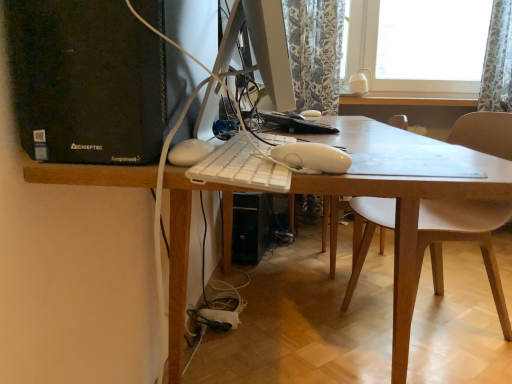
At what (x,y) coordinates should I click in order to perform the action: click on black plastic computer tower at left. Please return your answer as a coordinate pair (x, y). Image resolution: width=512 pixels, height=384 pixels. Looking at the image, I should click on (91, 81).

What do you see at coordinates (91, 81) in the screenshot? Image resolution: width=512 pixels, height=384 pixels. I see `black plastic computer tower at left` at bounding box center [91, 81].

The image size is (512, 384). What do you see at coordinates (403, 204) in the screenshot?
I see `white plastic desk at center` at bounding box center [403, 204].

What is the approximate width of white plastic keyboard at center?

The width of white plastic keyboard at center is 5.12 inches.

This screenshot has height=384, width=512. What are the coordinates of `floral fabric curtain at upper right` in the screenshot? It's located at (498, 61).

Describe the element at coordinates (498, 61) in the screenshot. This screenshot has width=512, height=384. I see `floral fabric curtain at upper right` at that location.

In order to click on black plastic computer tower at left in this screenshot , I will do `click(91, 81)`.

Identify the location of desk to the right of black plastic computer tower at left. (403, 204).

From a real-world perspective, is white plastic desk at center physically above black plastic computer tower at left?

No, from a real-world perspective, white plastic desk at center is not on top of black plastic computer tower at left.

Consider the image. In the image, is white plastic desk at center on the left side or the right side of black plastic computer tower at left?

Clearly, white plastic desk at center is on the right of black plastic computer tower at left in the image.

Which is closer to the camera, (x=128, y=171) or (x=20, y=123)?

Point (x=128, y=171) appears to be closer to the viewer than point (x=20, y=123).

How far apart are black plastic computer tower at left and white plastic keyboard at center?

black plastic computer tower at left is 9.49 inches away from white plastic keyboard at center.

Where is `computer keyboard in front of the black plastic computer tower at left`? computer keyboard in front of the black plastic computer tower at left is located at coordinates (240, 168).

Which of these two, black plastic computer tower at left or white plastic keyboard at center, is thinner?

Thinner between the two is white plastic keyboard at center.

In the scene shown: From a real-world perspective, is black plastic computer tower at left located beneath white plastic keyboard at center?

Actually, black plastic computer tower at left is physically above white plastic keyboard at center in the real world.

Is white plastic keyboard at center located within floral fabric curtain at upper right?

That's incorrect, white plastic keyboard at center is not inside floral fabric curtain at upper right.

Could you tell me if floral fabric curtain at upper right is facing white plastic keyboard at center?

No, floral fabric curtain at upper right does not turn towards white plastic keyboard at center.

Does point (490, 60) appear closer or farther from the camera than point (263, 159)?

Point (490, 60) is positioned farther from the camera compared to point (263, 159).

From a real-world perspective, does floral fabric curtain at upper right stand above black plastic computer tower at left?

Correct, in the physical world, floral fabric curtain at upper right is higher than black plastic computer tower at left.

Which is behind, point (510, 51) or point (103, 119)?

The point (510, 51) is more distant.

Does floral fabric curtain at upper right come behind black plastic computer tower at left?

Yes, it is.

Is floral fabric curtain at upper right far away from black plastic computer tower at left?

That's right, there is a large distance between floral fabric curtain at upper right and black plastic computer tower at left.

Are black plastic computer tower at left and floral fabric curtain at upper right located far from each other?

Yes, black plastic computer tower at left and floral fabric curtain at upper right are located far from each other.

Is black plastic computer tower at left surrounding floral fabric curtain at upper right?

Actually, floral fabric curtain at upper right is outside black plastic computer tower at left.

From a real-world perspective, relative to floral fabric curtain at upper right, is black plastic computer tower at left vertically above or below?

From a real-world perspective, black plastic computer tower at left is physically below floral fabric curtain at upper right.

Would you say white plastic desk at center is part of black plastic computer tower at left's contents?

No, black plastic computer tower at left does not contain white plastic desk at center.

Based on the photo, is black plastic computer tower at left not near white plastic desk at center?

That's not correct — black plastic computer tower at left is a little close to white plastic desk at center.

Which is behind, black plastic computer tower at left or white plastic desk at center?

black plastic computer tower at left is behind.

From the image's perspective, which one is positioned lower, floral fabric curtain at upper right or white plastic desk at center?

white plastic desk at center appears lower in the image.

Which of these two, floral fabric curtain at upper right or white plastic desk at center, is thinner?

With smaller width is floral fabric curtain at upper right.

From a real-world perspective, does floral fabric curtain at upper right sit lower than white plastic desk at center?

No, from a real-world perspective, floral fabric curtain at upper right is not beneath white plastic desk at center.

Are floral fabric curtain at upper right and white plastic desk at center making contact?

No, floral fabric curtain at upper right is not beside white plastic desk at center.

At what (x,y) coordinates should I click in order to perform the action: click on desk that is on the right side of black plastic computer tower at left. Please return your answer as a coordinate pair (x, y). The height and width of the screenshot is (384, 512). Looking at the image, I should click on (403, 204).

Where is `computer tower on the left side of white plastic keyboard at center`? computer tower on the left side of white plastic keyboard at center is located at coordinates (91, 81).

Looking at the image, which one is located further to white plastic keyboard at center, white plastic desk at center or floral fabric curtain at upper right?

floral fabric curtain at upper right lies further to white plastic keyboard at center than the other object.

Considering their positions, is black plastic computer tower at left positioned closer to floral fabric curtain at upper right than white plastic keyboard at center?

white plastic keyboard at center.

When comparing their distances from black plastic computer tower at left, does floral fabric curtain at upper right or white plastic desk at center seem closer?

Based on the image, white plastic desk at center appears to be nearer to black plastic computer tower at left.

Looking at the image, which one is located further to floral fabric curtain at upper right, white plastic desk at center or white plastic keyboard at center?

The object further to floral fabric curtain at upper right is white plastic keyboard at center.

Based on their spatial positions, is white plastic keyboard at center or black plastic computer tower at left further from white plastic desk at center?

white plastic keyboard at center is positioned further to the anchor white plastic desk at center.

Which object lies further to the anchor point white plastic desk at center, white plastic keyboard at center or floral fabric curtain at upper right?

The object further to white plastic desk at center is floral fabric curtain at upper right.

Based on their spatial positions, is white plastic desk at center or black plastic computer tower at left closer to white plastic keyboard at center?

black plastic computer tower at left is closer to white plastic keyboard at center.

Considering their positions, is white plastic desk at center positioned further to floral fabric curtain at upper right than black plastic computer tower at left?

The object further to floral fabric curtain at upper right is black plastic computer tower at left.

You are a GUI agent. You are given a task and a screenshot of the screen. Output one action in this format:
    pyautogui.click(x=<x>, y=<y>)
    Task: Click on the computer tower between white plastic desk at center and floral fabric curtain at upper right from front to back
    
    Given the screenshot: What is the action you would take?
    pyautogui.click(x=91, y=81)

Where is `computer tower located between white plastic keyboard at center and floral fabric curtain at upper right in the depth direction`? The height and width of the screenshot is (384, 512). computer tower located between white plastic keyboard at center and floral fabric curtain at upper right in the depth direction is located at coordinates (91, 81).

In order to click on computer keyboard between black plastic computer tower at left and white plastic desk at center in the up-down direction in this screenshot , I will do `click(240, 168)`.

Identify the location of desk between white plastic keyboard at center and floral fabric curtain at upper right along the z-axis. This screenshot has width=512, height=384. (403, 204).